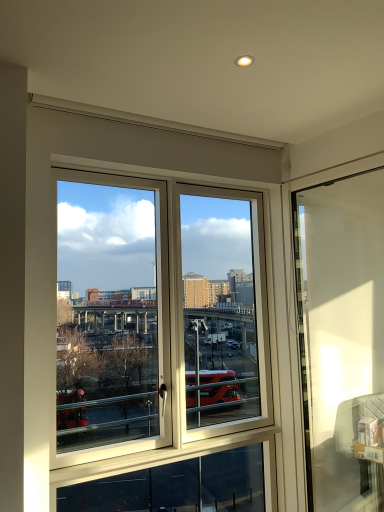
Where is `transparent glass window at right`? Image resolution: width=384 pixels, height=512 pixels. transparent glass window at right is located at coordinates (342, 339).

Describe the element at coordinates (342, 339) in the screenshot. I see `transparent glass window at right` at that location.

Image resolution: width=384 pixels, height=512 pixels. In order to click on transparent glass window at right in this screenshot , I will do `click(342, 339)`.